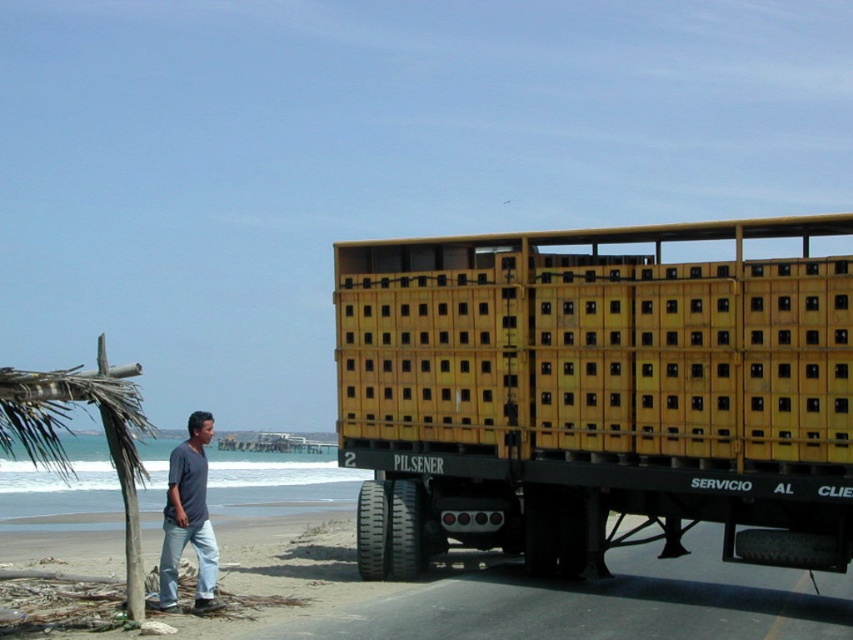
Question: Where is yellow matte trailer truck at center located in relation to dark blue t-shirt at lower left in the image?

Choices:
 (A) left
 (B) right

Answer: (B)

Question: Can you confirm if yellow matte trailer truck at center is bigger than dark blue t-shirt at lower left?

Choices:
 (A) no
 (B) yes

Answer: (A)

Question: Can you confirm if yellow matte trailer truck at center is positioned to the left of dark blue t-shirt at lower left?

Choices:
 (A) no
 (B) yes

Answer: (A)

Question: Which object is closer to the camera taking this photo?

Choices:
 (A) dark blue t-shirt at lower left
 (B) yellow matte trailer truck at center

Answer: (A)

Question: Among these points, which one is nearest to the camera?

Choices:
 (A) (200, 472)
 (B) (796, 544)

Answer: (A)